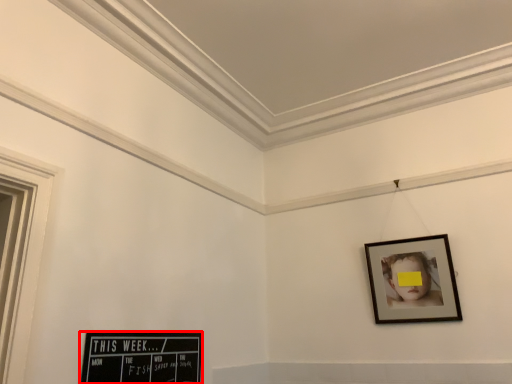
Question: From the image's perspective, what is the correct spatial positioning of picture frame (annotated by the red box) in reference to picture frame?

Choices:
 (A) above
 (B) below

Answer: (B)